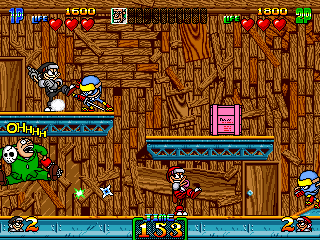
Identify the location of boxes. This screenshot has height=240, width=320. (230, 125).